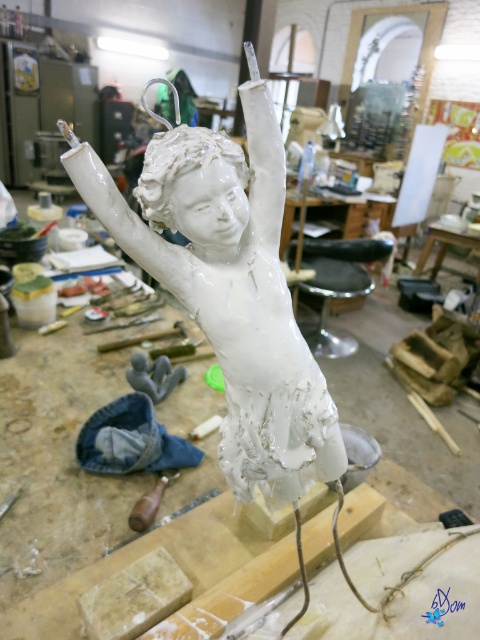
Question: Can you confirm if white glossy statue at center is smaller than wooden handle at center?

Choices:
 (A) no
 (B) yes

Answer: (A)

Question: Can you confirm if white glossy statue at center is smaller than wooden handle at center?

Choices:
 (A) yes
 (B) no

Answer: (B)

Question: Which point appears farthest from the camera in this image?

Choices:
 (A) (156, 486)
 (B) (283, 163)

Answer: (A)

Question: Which object is farther from the camera taking this photo?

Choices:
 (A) white glossy statue at center
 (B) wooden handle at center

Answer: (B)

Question: Is white glossy statue at center smaller than wooden handle at center?

Choices:
 (A) yes
 (B) no

Answer: (B)